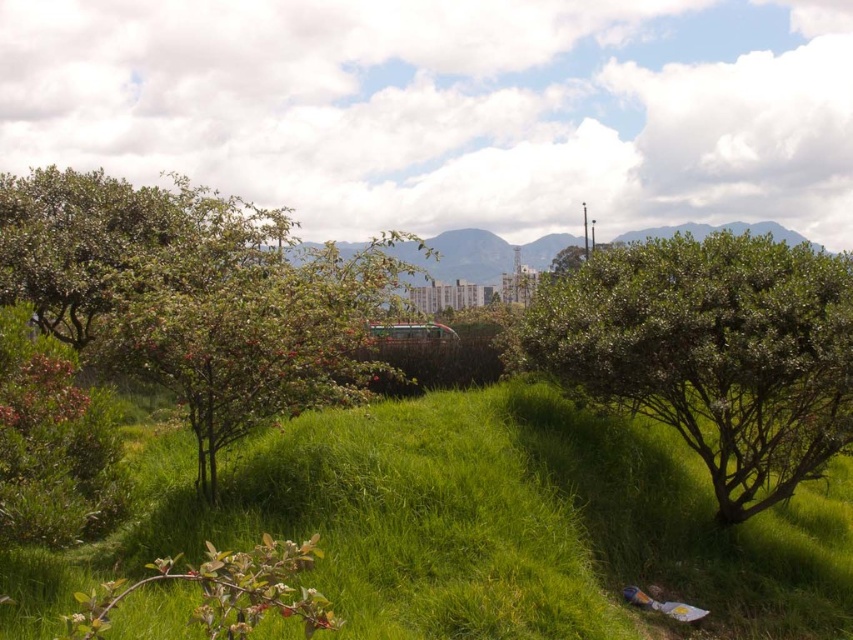
This screenshot has width=853, height=640. What do you see at coordinates (486, 525) in the screenshot? I see `green grass at center` at bounding box center [486, 525].

Is green grass at center taller than green leafy bush at center?

No, green grass at center is not taller than green leafy bush at center.

Find the location of a particular element. The height and width of the screenshot is (640, 853). green grass at center is located at coordinates (486, 525).

The image size is (853, 640). I want to click on green grass at center, so click(x=486, y=525).

Is green leafy bush at left in front of green leafy bush at center?

Yes, it is in front of green leafy bush at center.

In the scene shown: Who is higher up, green leafy bush at left or green leafy bush at center?

green leafy bush at left is above.

Locate an element on the screen. This screenshot has height=640, width=853. green leafy bush at left is located at coordinates (196, 296).

Can you confirm if green grass at center is smaller than green leafy bush at left?

Correct, green grass at center occupies less space than green leafy bush at left.

Where is `green grass at center`? This screenshot has width=853, height=640. green grass at center is located at coordinates (486, 525).

The width and height of the screenshot is (853, 640). Identify the location of green grass at center. (486, 525).

Where is `green grass at center`? Image resolution: width=853 pixels, height=640 pixels. green grass at center is located at coordinates (486, 525).